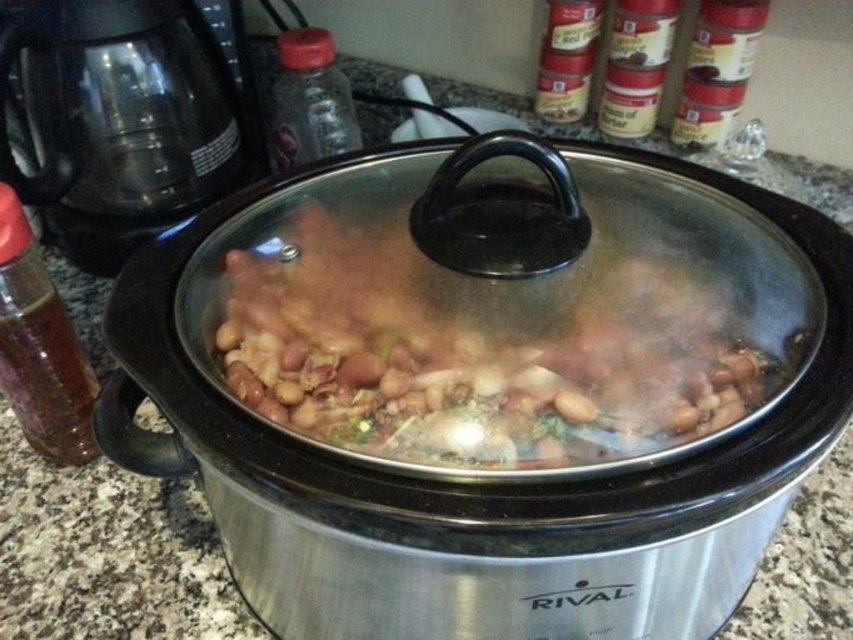
You are standing at the kitchen counter looking at the stainless steel crock pot at center and the brown matte beans at center. Which object is located to the left?

The brown matte beans at center are to the left of the stainless steel crock pot at center.

You are a delivery person who just arrived at the kitchen to pick up an order. You see the translucent glass bottle at left on the counter. If you are standing 50 centimeters away from it, can you reach it without moving your feet?

The translucent glass bottle at left is 50.03 centimeters away from the viewer. Since you are standing 50 centimeters away, you are almost at the same distance and might need to stretch slightly, but it depends on your arm length. However, the question states not to assume additional details like arm length. Therefore, based on the given information, the distance is just over 50 cm, so you might not be able to reach it without moving.

You are a delivery person who just arrived at the house. You need to place a small package on the kitchen counter near the slow cooker. According to the image, where should you place the package so that it is closest to the stainless steel crock pot at center?

The stainless steel crock pot at center is located at point (485,477), so you should place the package near that coordinate to be closest to it.